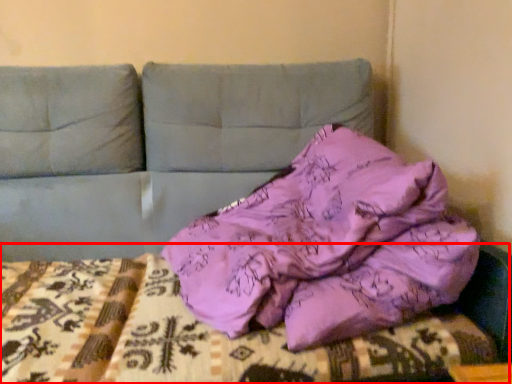
Question: Considering the relative positions of bed frame (annotated by the red box) and pillow in the image provided, where is bed frame (annotated by the red box) located with respect to the staircase?

Choices:
 (A) left
 (B) right

Answer: (A)